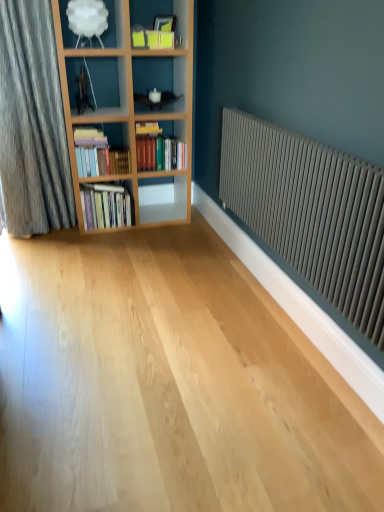
This screenshot has height=512, width=384. Find the location of `empty space that is to the right of hardcover books at left, which is the 3th book in top-to-bottom order`. empty space that is to the right of hardcover books at left, which is the 3th book in top-to-bottom order is located at coordinates (145, 225).